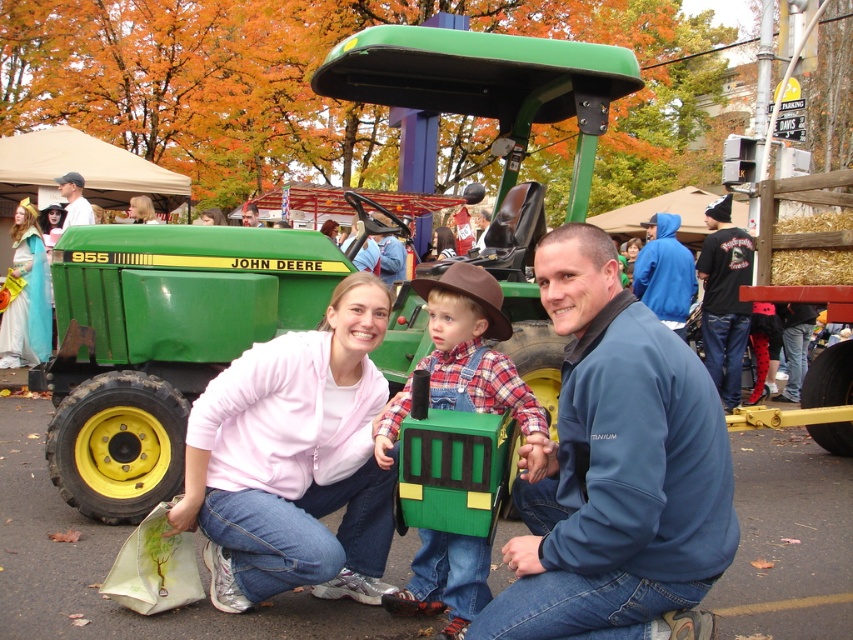
You are a photographer taking a picture of the family at the festival. You notice the brown matte cowboy hat at center and the blonde hair at center. Which object is positioned lower in the image?

The brown matte cowboy hat at center is located below blonde hair at center, so it is positioned lower in the image.